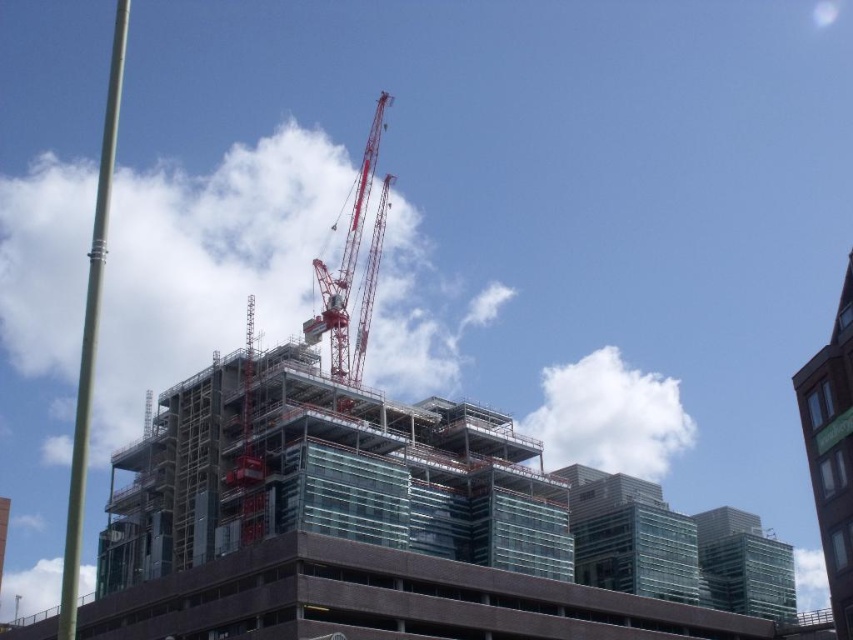
You are an architect observing the construction site. You need to determine if the brown brick building at upper right is shorter than the red metallic crane at center. Based on the scene, what can you conclude?

The brown brick building at upper right has a lesser height compared to the red metallic crane at center, so the crane is taller than the building.

You are a construction worker who needs to transport materials from the brown brick building at upper right to the red metallic crane at center. Which object has a larger width to accommodate more materials?

The brown brick building at upper right might be wider than the red metallic crane at center, so it could have more space to accommodate materials.

Looking at this image, you are a construction worker planning to move a heavy load from the brown brick building at upper right to the red metallic crane at center. Which direction should you move the load relative to the crane?

The brown brick building at upper right is to the right of the red metallic crane at center, so you should move the load to the left towards the crane.